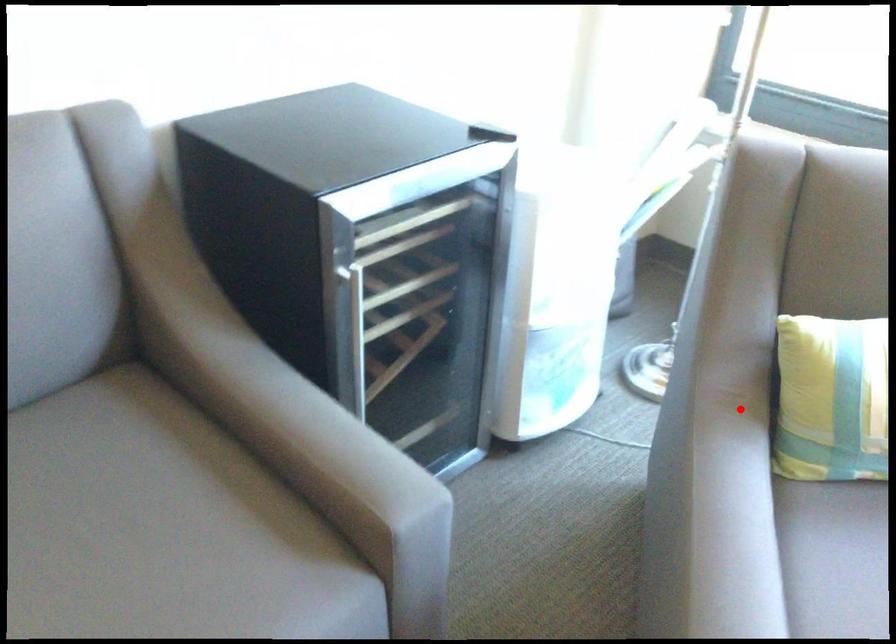
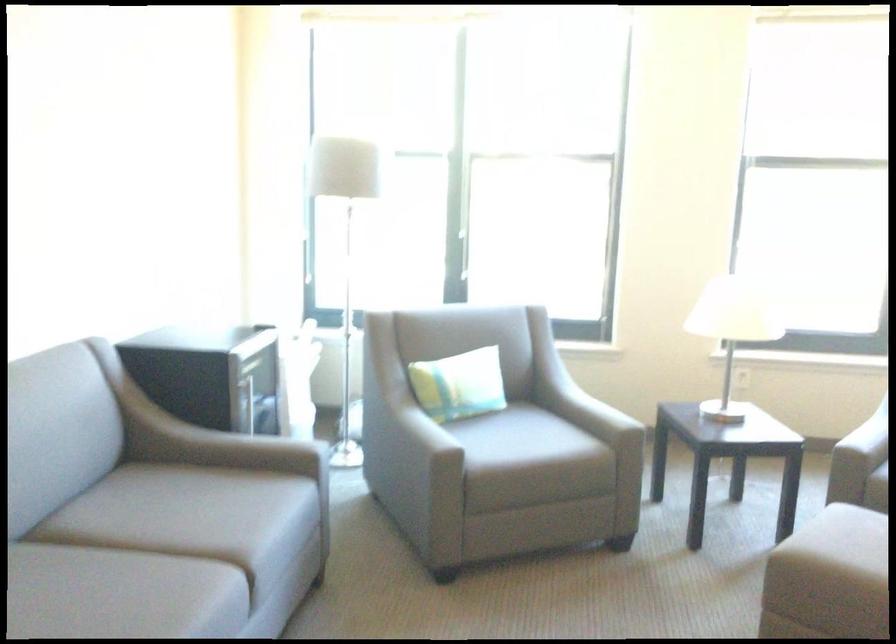
Where in the second image is the point corresponding to the highlighted location from the first image?

(356, 420)